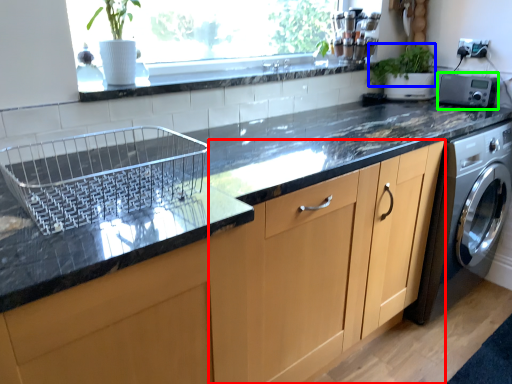
Question: Which object is positioned closest to cabinetry (highlighted by a red box)? Select from plant (highlighted by a blue box) and appliance (highlighted by a green box).

Choices:
 (A) plant
 (B) appliance

Answer: (B)